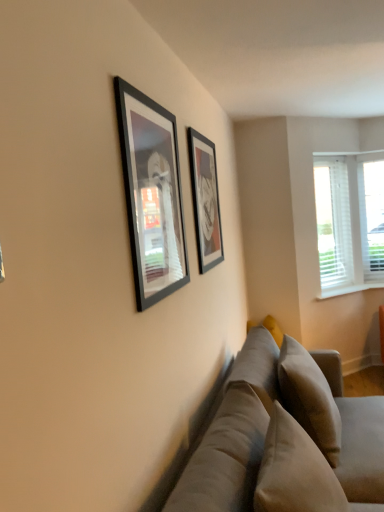
Question: Is white plastic blinds at right not within soft beige pillow at lower right?

Choices:
 (A) yes
 (B) no

Answer: (A)

Question: Is white plastic blinds at right turned away from soft beige pillow at lower right?

Choices:
 (A) no
 (B) yes

Answer: (A)

Question: From the image's perspective, does white plastic blinds at right appear lower than soft beige pillow at lower right?

Choices:
 (A) no
 (B) yes

Answer: (A)

Question: Can you confirm if white plastic blinds at right is thinner than soft beige pillow at lower right?

Choices:
 (A) no
 (B) yes

Answer: (B)

Question: Would you say white plastic blinds at right contains soft beige pillow at lower right?

Choices:
 (A) no
 (B) yes

Answer: (A)

Question: Choose the correct answer: Is soft beige pillow at lower right inside soft beige fabric couch at lower right or outside it?

Choices:
 (A) inside
 (B) outside

Answer: (A)

Question: From their relative heights in the image, would you say soft beige pillow at lower right is taller or shorter than soft beige fabric couch at lower right?

Choices:
 (A) short
 (B) tall

Answer: (A)

Question: Is soft beige pillow at lower right wider or thinner than soft beige fabric couch at lower right?

Choices:
 (A) thin
 (B) wide

Answer: (A)

Question: From a real-world perspective, is soft beige pillow at lower right positioned above or below soft beige fabric couch at lower right?

Choices:
 (A) above
 (B) below

Answer: (A)

Question: Does point (210, 196) appear closer or farther from the camera than point (329, 237)?

Choices:
 (A) closer
 (B) farther

Answer: (A)

Question: Considering the positions of matte black picture frame at center, arranged as the 1th picture frame when viewed from the right, and white plastic blinds at right in the image, is matte black picture frame at center, arranged as the 1th picture frame when viewed from the right, bigger or smaller than white plastic blinds at right?

Choices:
 (A) big
 (B) small

Answer: (B)

Question: Which is correct: matte black picture frame at center, arranged as the 1th picture frame when viewed from the right, is inside white plastic blinds at right, or outside of it?

Choices:
 (A) outside
 (B) inside

Answer: (A)

Question: Relative to white plastic blinds at right, is matte black picture frame at center, which is counted as the first picture frame, starting from the back, in front or behind?

Choices:
 (A) front
 (B) behind

Answer: (A)

Question: Is soft beige pillow at lower right wider or thinner than matte black picture frame at center, arranged as the 1th picture frame when viewed from the right?

Choices:
 (A) wide
 (B) thin

Answer: (A)

Question: Is point (322, 453) positioned closer to the camera than point (210, 180)?

Choices:
 (A) farther
 (B) closer

Answer: (B)